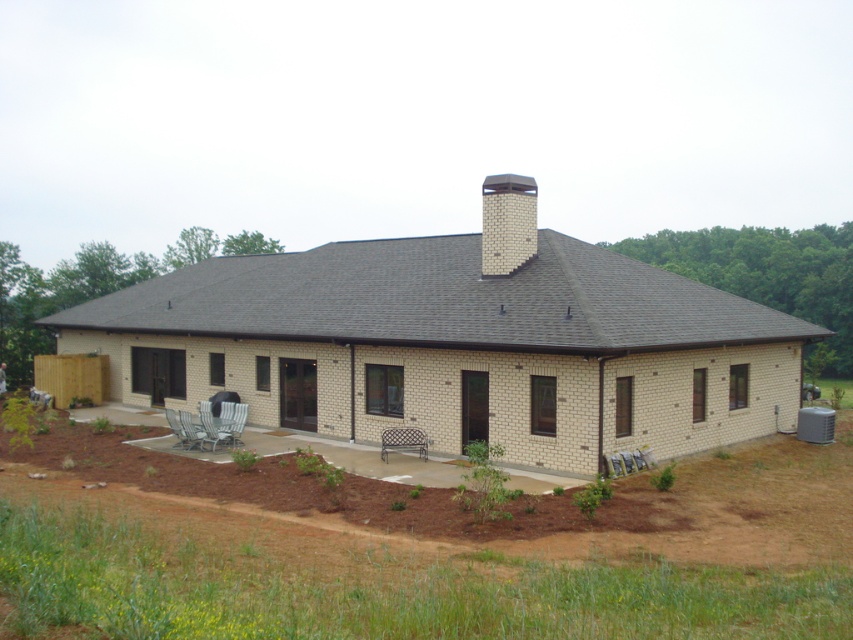
You are standing at the entrance of the building and want to walk to the point marked by point (527, 252). There is an obstacle at point (383, 460). Will you need to go around the obstacle to reach your destination?

Point (527, 252) is behind point (383, 460), so yes, you will need to go around the obstacle at point (383, 460) to reach your destination.